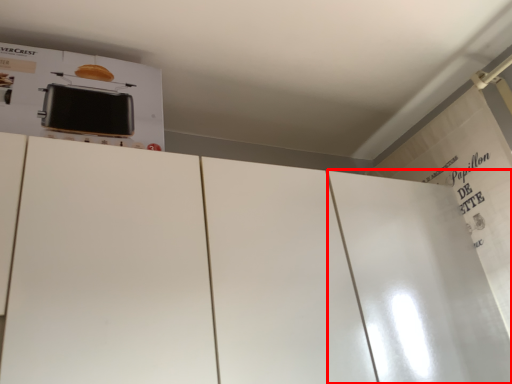
Question: Where is door (annotated by the red box) located in relation to appliance in the image?

Choices:
 (A) left
 (B) right

Answer: (B)